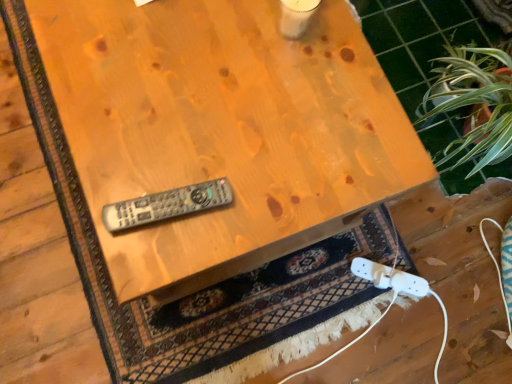
The height and width of the screenshot is (384, 512). I want to click on blank space situated above wooden remote control at center (from a real-world perspective), so click(x=197, y=87).